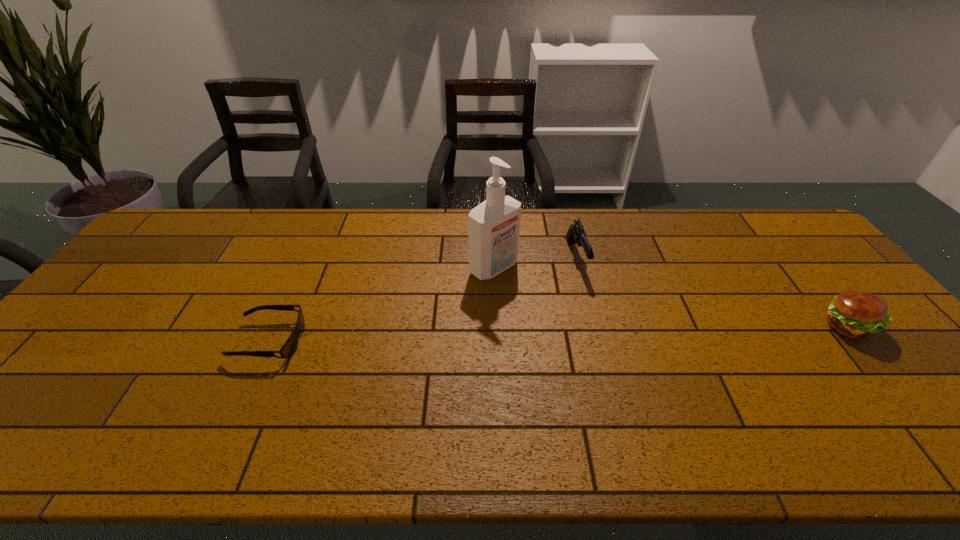
I want to click on vacant space that satisfies the following two spatial constraints: 1. on the front side of the Lego; 2. on the left side of the gun, so click(496, 258).

I want to click on blank area in the image that satisfies the following two spatial constraints: 1. on the front side of the second object from right to left; 2. on the right side of the Lego, so click(x=496, y=258).